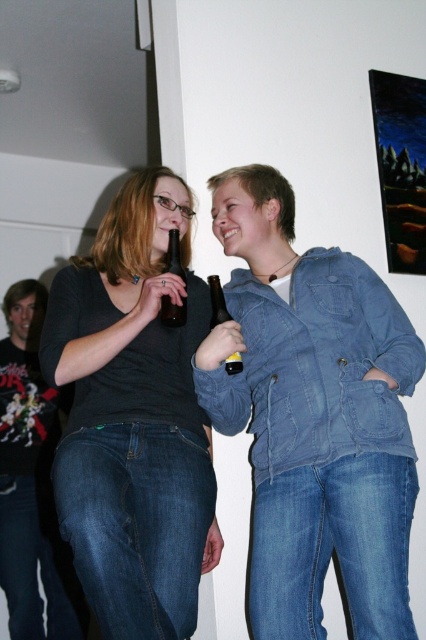
Can you confirm if denim jacket at lower right is positioned to the left of brown glass bottle at center?

Incorrect, denim jacket at lower right is not on the left side of brown glass bottle at center.

Can you confirm if denim jacket at lower right is thinner than brown glass bottle at center?

No.

Is point (331, 477) behind point (178, 241)?

That is False.

You are a GUI agent. You are given a task and a screenshot of the screen. Output one action in this format:
    pyautogui.click(x=<x>, y=<y>)
    Task: Click on the denim jacket at lower right
    This screenshot has width=426, height=640.
    Given the screenshot: What is the action you would take?
    pyautogui.click(x=313, y=416)

Can you confirm if brown glass bottle at center is smaller than matte glass bottle at center?

Yes, brown glass bottle at center is smaller than matte glass bottle at center.

This screenshot has height=640, width=426. What do you see at coordinates (172, 310) in the screenshot?
I see `brown glass bottle at center` at bounding box center [172, 310].

Identify the location of brown glass bottle at center. tap(172, 310).

Can you confirm if matte black shirt at center is shorter than brown glass bottle at center?

No, matte black shirt at center is not shorter than brown glass bottle at center.

Is matte black shirt at center thinner than brown glass bottle at center?

No.

Between point (152, 548) and point (184, 312), which one is positioned in front?

Point (152, 548) is more forward.

Where is `matte black shirt at center`? Image resolution: width=426 pixels, height=640 pixels. matte black shirt at center is located at coordinates (134, 419).